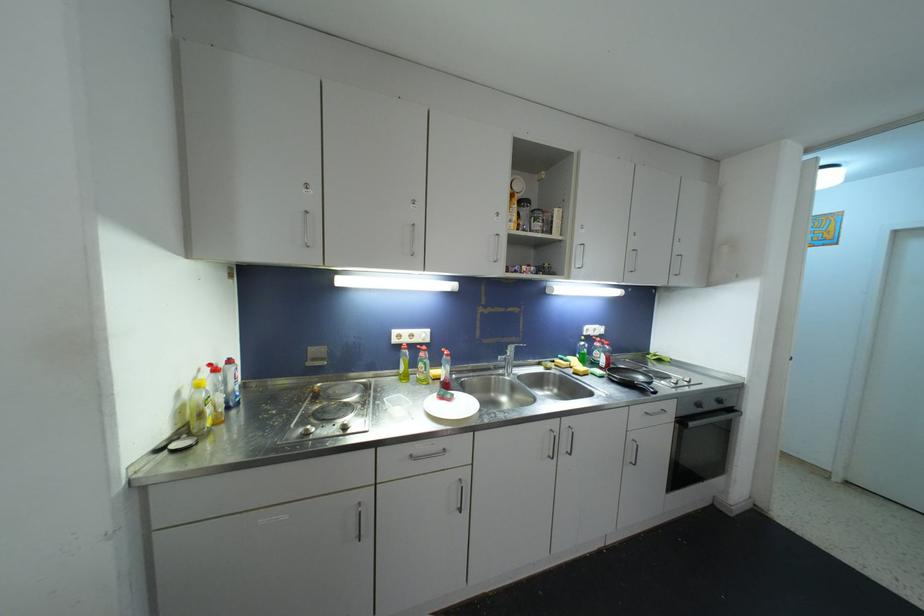
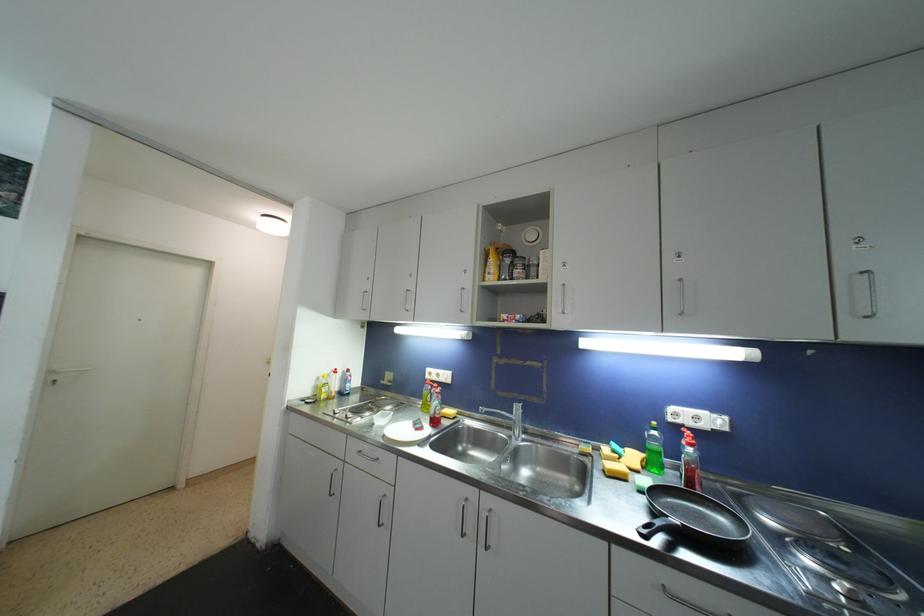
In the second image, find the point that corresponds to the point at 415,339 in the first image.

(441, 378)